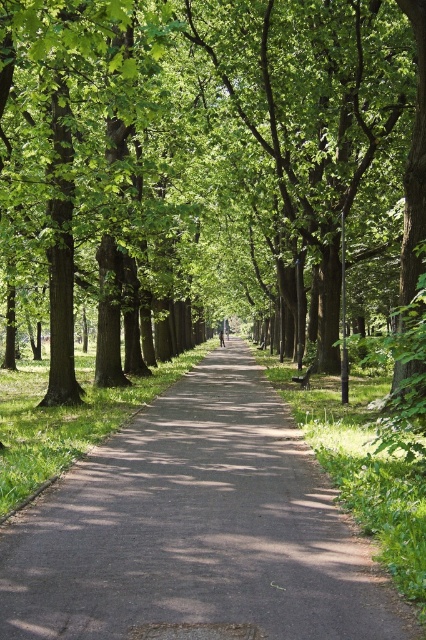
Is green leafy tree at center thinner than dark gray asphalt path at center?

In fact, green leafy tree at center might be wider than dark gray asphalt path at center.

Which of these two, green leafy tree at center or dark gray asphalt path at center, stands shorter?

With less height is dark gray asphalt path at center.

Between point (66, 272) and point (172, 502), which one is positioned behind?

The point (66, 272) is behind.

At what (x,y) coordinates should I click in order to perform the action: click on green leafy tree at center. Please return your answer as a coordinate pair (x, y). Looking at the image, I should click on (207, 172).